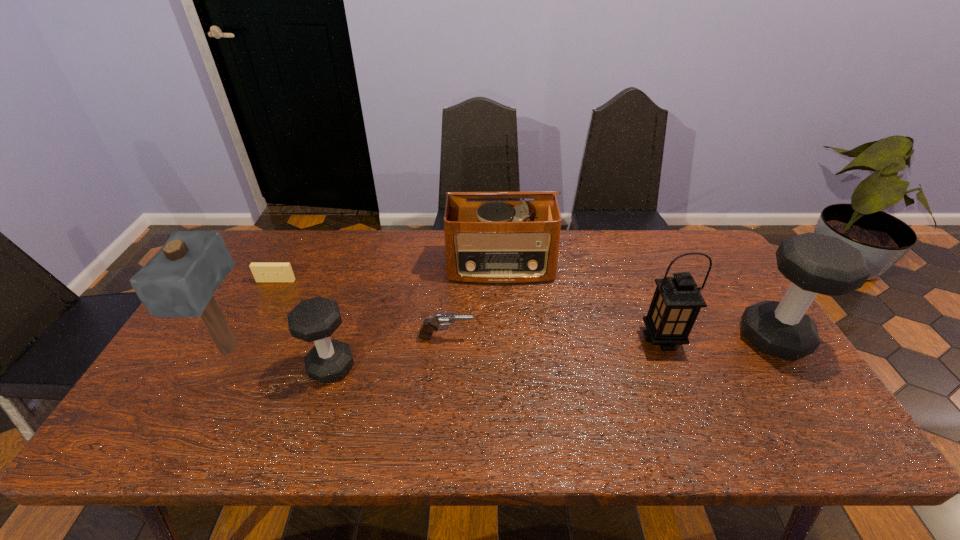
Where is `the third shortest object`? the third shortest object is located at coordinates (316, 319).

I want to click on the left dumbbell, so coord(316,319).

Locate an element on the screen. The image size is (960, 540). the right dumbbell is located at coordinates (814, 263).

The image size is (960, 540). I want to click on the taller dumbbell, so click(x=814, y=263).

Locate an element on the screen. This screenshot has height=540, width=960. videotape is located at coordinates (263, 272).

Locate an element on the screen. radio receiver is located at coordinates (486, 242).

Find the location of a particular element. Image resolution: width=960 pixels, height=540 pixels. mallet is located at coordinates point(180,280).

Identify the location of pistol. (439, 319).

Identify the location of the sixth object from left to right. (676, 303).

Locate an element on the screen. vacant position located 0.160m on the left of the fifth tallest object is located at coordinates (245, 367).